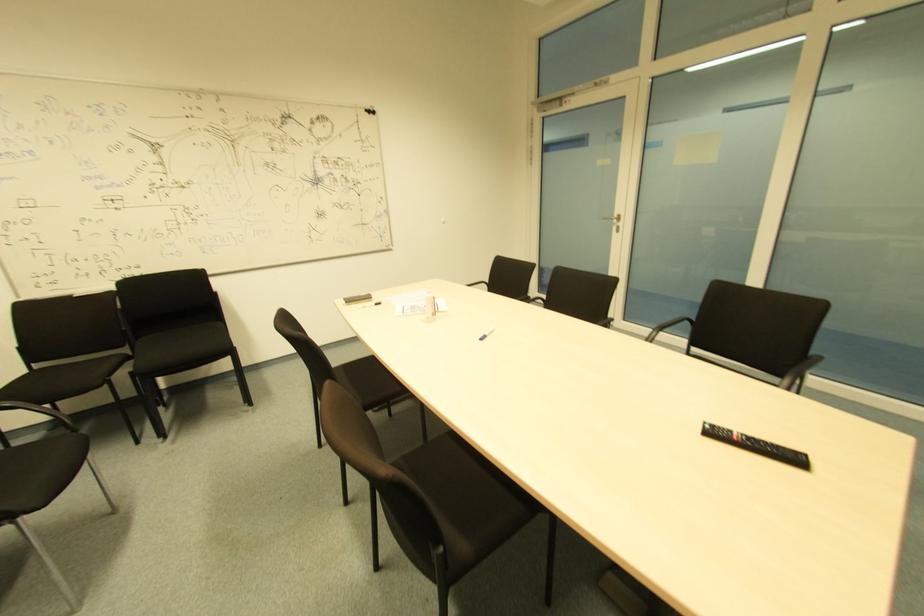
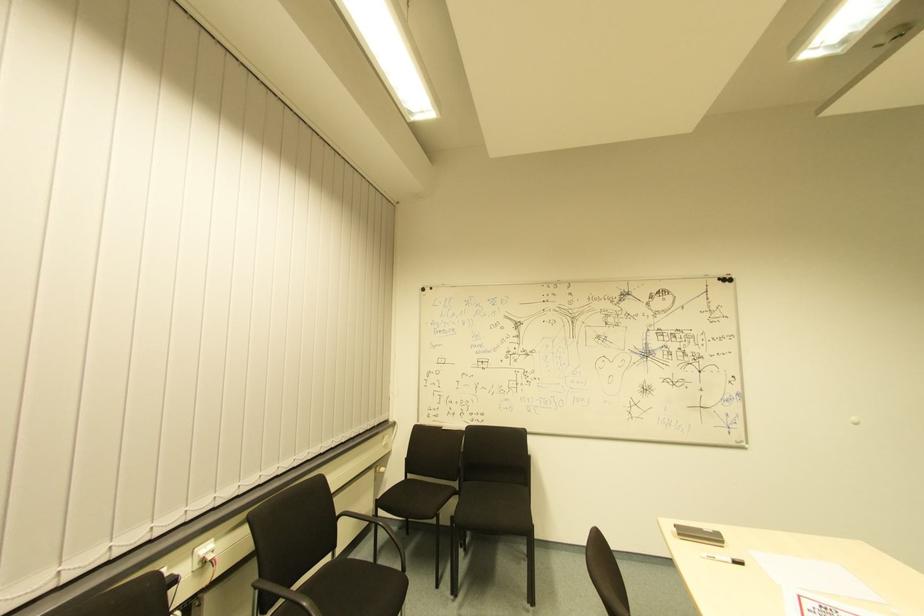
Find the pixel in the second image that matches point (34, 370) in the first image.

(408, 479)